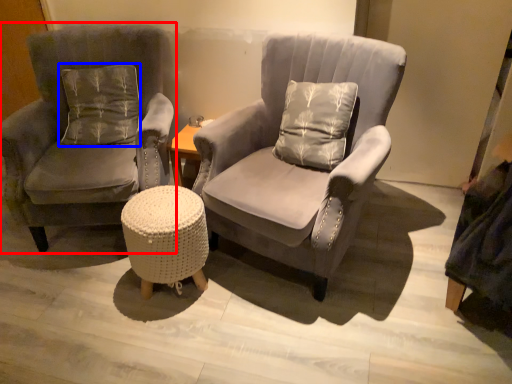
Question: Which of the following is the closest to the observer, chair (highlighted by a red box) or pillow (highlighted by a blue box)?

Choices:
 (A) chair
 (B) pillow

Answer: (A)